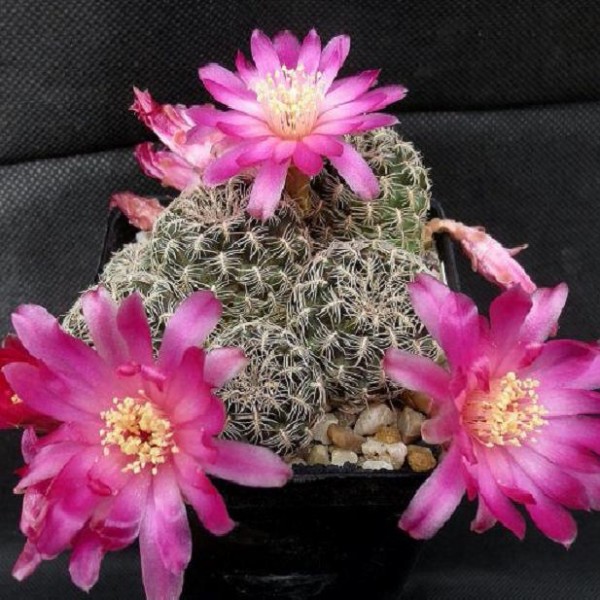
You are a GUI agent. You are given a task and a screenshot of the screen. Output one action in this format:
    pyautogui.click(x=<x>, y=<y>)
    Task: Click on the cushion
    The image size is (600, 600).
    Given the screenshot: What is the action you would take?
    click(515, 175)